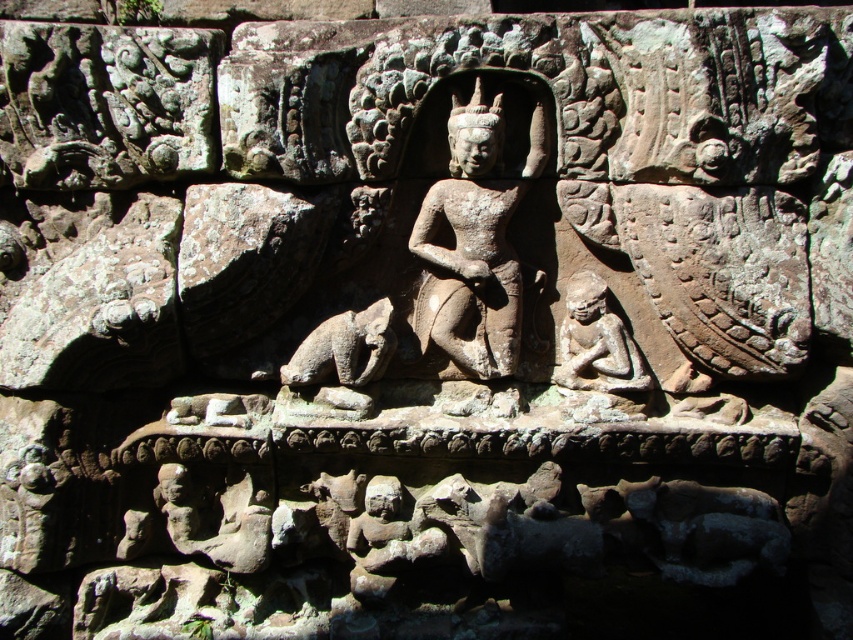
You are an archaeologist examining the stone relief. You notice two figures at the center. Which one is taller between the gray stone statue at center and the carved stone figure at center?

The gray stone statue at center is taller than the carved stone figure at center according to the description provided.

Consider the image. You are standing in front of the stone relief and want to touch the point at coordinates point (x=498, y=372). If your arm can reach 4.5 feet, will you be able to reach it?

The distance between you and point (x=498, y=372) is 4.80 feet, which is longer than your arm reach of 4.5 feet. Therefore, you cannot reach it.

In the scene of the ancient stone relief, there is a carved stone figure at center and a brown stone dog at center. Which object is taller?

The carved stone figure at center is taller than the brown stone dog at center.